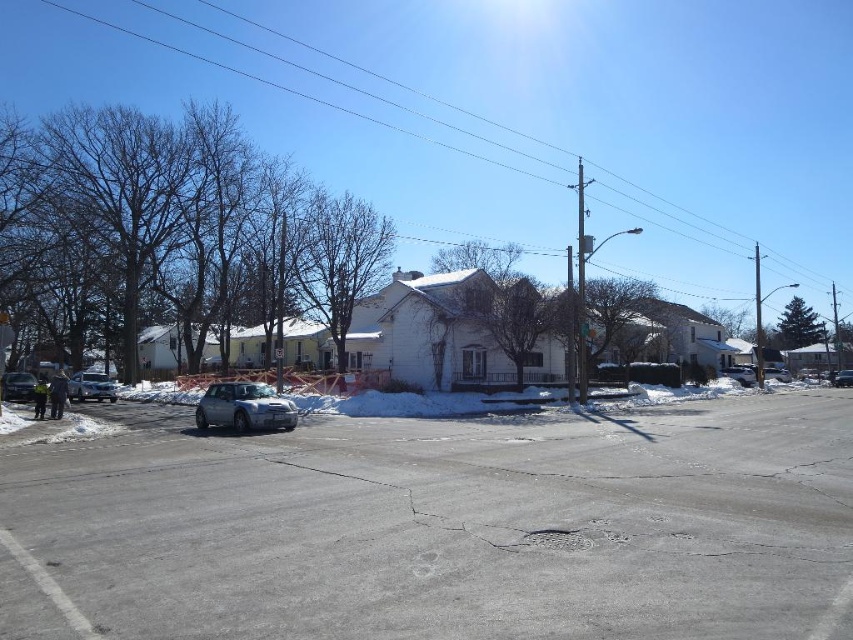
You are standing at point A located at coordinates point A is at point (1, 392). You want to walk to point B which is 40.51 meters away from point A. Given the suburban street scene described, is there any obstruction between point A and point B that might block your path?

The distance between point A and point B is 40.51 meters. The suburban street scene includes a paved road with a manhole cover and a parked silver car. Since the road curves slightly to the right and there are houses in the middle ground, it is possible that the path between the two points may be obstructed by the parked car or the curvature of the road. However, without specific information about the exact location of point B relative to these objects, it is difficult to determine obstructions definitively

You are a delivery driver who needs to park your truck between the satin silver car at center and the satin silver sedan at right. Your truck is 2 meters wide. Can you fit your truck between them?

The satin silver car at center is wider than the satin silver sedan at right. However, the exact distance between them isn not provided, so it is impossible to determine if the truck can fit.